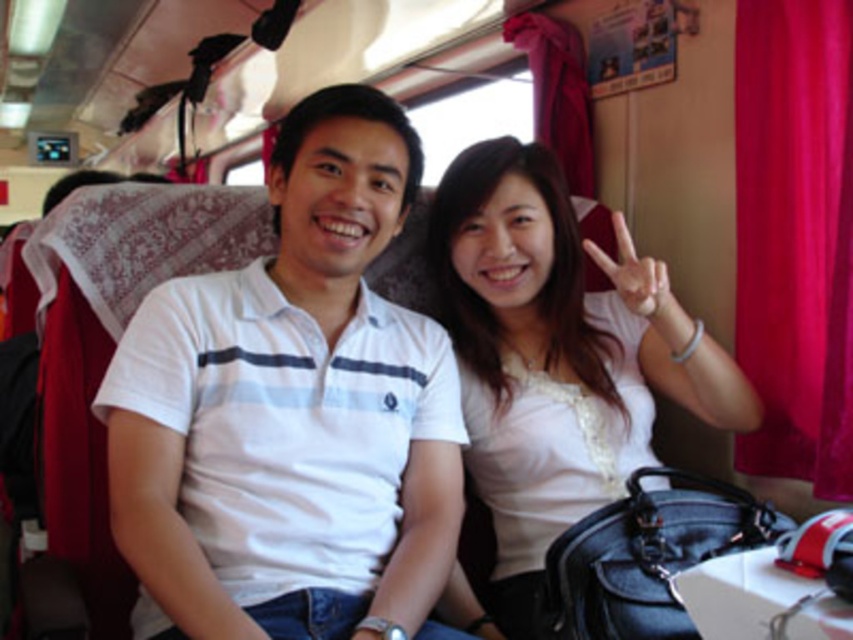
You are a photographer trying to capture a clear shot of the white cotton shirt at center without the red velvet curtain at right appearing in the background. Based on the scene description, can you position yourself in a way to achieve this?

The white cotton shirt at center is in front of the red velvet curtain at right, so if you position yourself behind the white cotton shirt at center, the curtain will be out of the frame. Alternatively, moving to the side opposite the red velvet curtain at right could also ensure the curtain isn not in the background.

You are designing a virtual tour of the train carriage and need to place a digital marker at the exact center of the white cotton shirt at center. What are the coordinates where you should place the marker?

The coordinates for the white cotton shirt at center are at point (293, 408), so place the digital marker there.